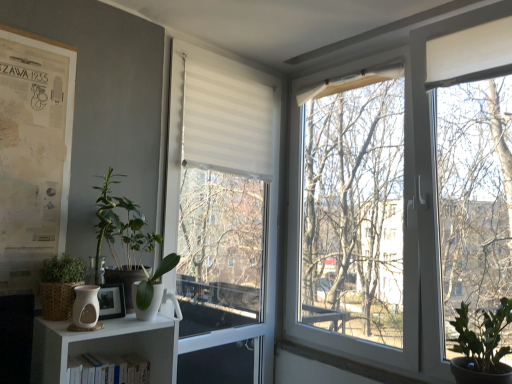
The image size is (512, 384). I want to click on free spot above white matte bookshelf at lower left (from a real-world perspective), so click(x=103, y=348).